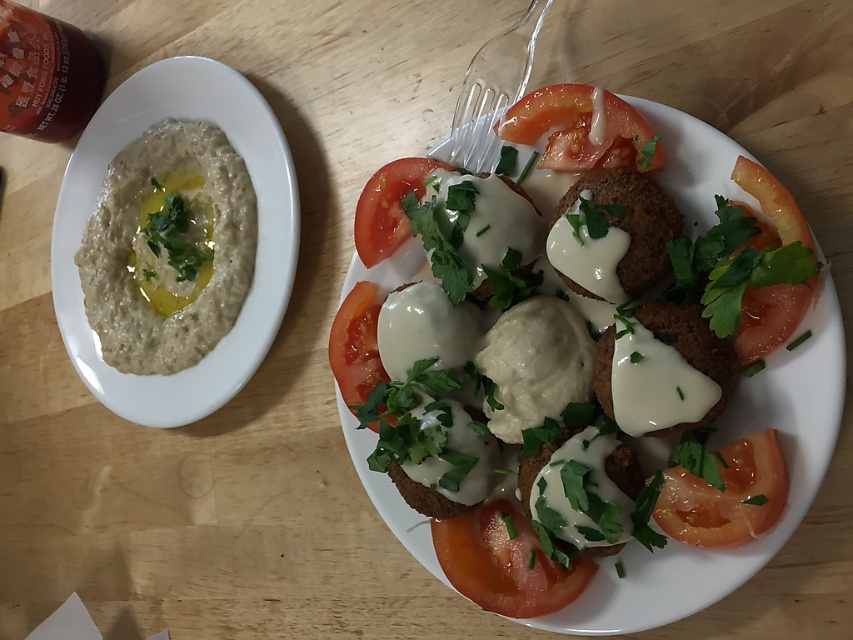
Who is positioned more to the right, white creamy falafel at center or red smooth tomato at center?

From the viewer's perspective, white creamy falafel at center appears more on the right side.

Who is shorter, white creamy falafel at center or red smooth tomato at center?

With less height is red smooth tomato at center.

Is point (746, 204) positioned behind point (392, 182)?

No, (746, 204) is closer to viewer.

You are a GUI agent. You are given a task and a screenshot of the screen. Output one action in this format:
    pyautogui.click(x=<x>, y=<y>)
    Task: Click on the white creamy falafel at center
    
    Given the screenshot: What is the action you would take?
    pyautogui.click(x=717, y=445)

Looking at this image, does juicy red tomato at upper center appear under smooth red tomato at center?

Actually, juicy red tomato at upper center is above smooth red tomato at center.

Does point (576, 164) come closer to viewer compared to point (350, 305)?

That is True.

Is point (558, 113) farther from viewer compared to point (344, 304)?

No, (558, 113) is closer to viewer.

In order to click on juicy red tomato at upper center in this screenshot , I will do `click(578, 125)`.

Is red matte tomato at center wider than slightly translucent tomato at lower right?

Yes, red matte tomato at center is wider than slightly translucent tomato at lower right.

Is point (445, 522) positioned behind point (701, 531)?

Yes.

At what (x,y) coordinates should I click in order to perform the action: click on red matte tomato at center. Please return your answer as a coordinate pair (x, y). This screenshot has width=853, height=640. Looking at the image, I should click on (503, 563).